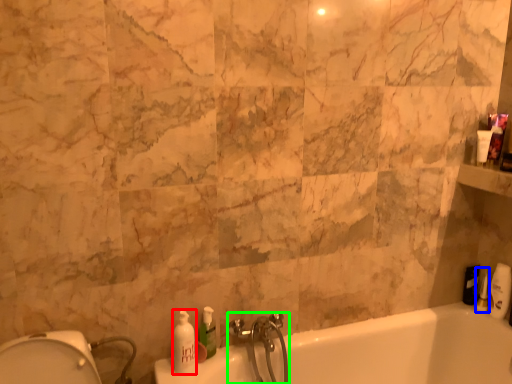
Question: Which object is positioned farthest from soap dispenser (highlighted by a red box)? Select from toiletry (highlighted by a blue box) and tap (highlighted by a green box).

Choices:
 (A) toiletry
 (B) tap

Answer: (A)